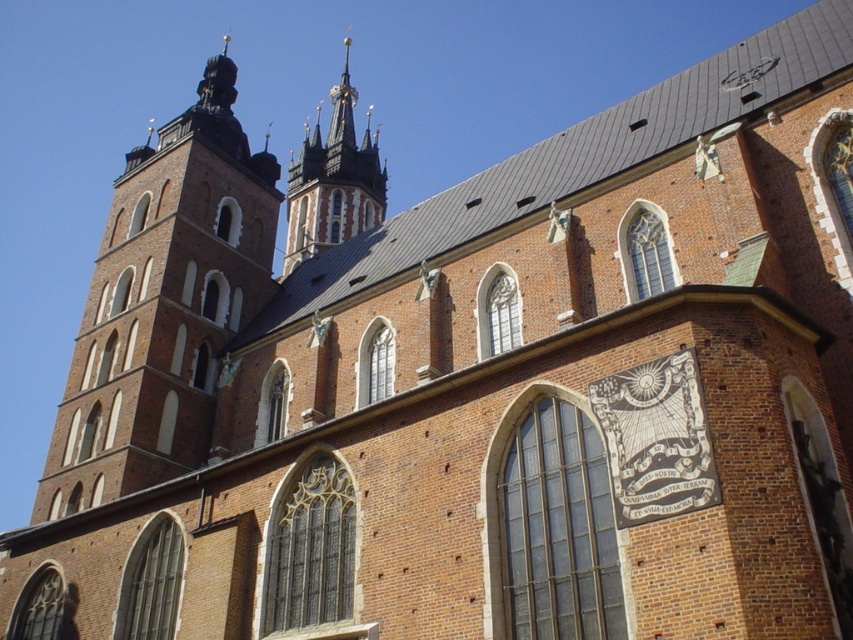
Question: Is brown brick tower at center-left further to camera compared to smooth stone spires at upper center?

Choices:
 (A) no
 (B) yes

Answer: (A)

Question: Which point is farther to the camera?

Choices:
 (A) smooth stone spires at upper center
 (B) brown brick tower at center-left

Answer: (A)

Question: From the image, what is the correct spatial relationship of brown brick tower at center-left in relation to smooth stone spires at upper center?

Choices:
 (A) left
 (B) right

Answer: (A)

Question: Can you confirm if brown brick tower at center-left is smaller than smooth stone spires at upper center?

Choices:
 (A) no
 (B) yes

Answer: (A)